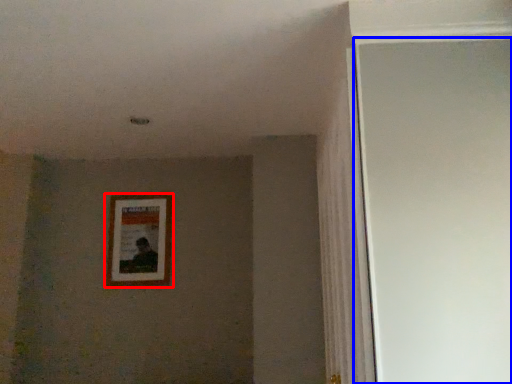
Question: Which of the following is the farthest to the observer, picture frame (highlighted by a red box) or glass door (highlighted by a blue box)?

Choices:
 (A) picture frame
 (B) glass door

Answer: (A)